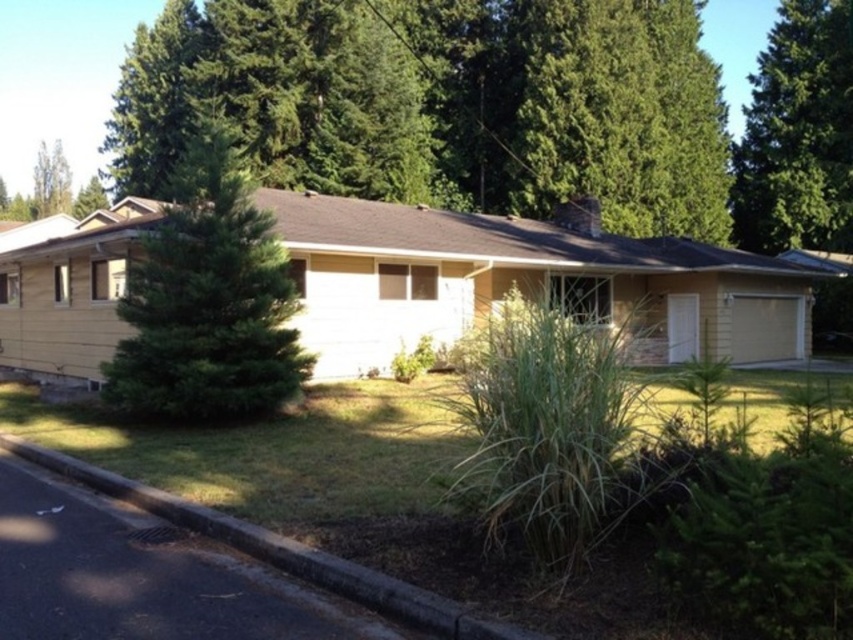
Question: Is green needle-like tree at left below green leafy tree at upper right?

Choices:
 (A) no
 (B) yes

Answer: (B)

Question: Which object is positioned closest to the green leafy tree at upper right?

Choices:
 (A) green needle-like tree at left
 (B) black asphalt curb at lower left

Answer: (A)

Question: Based on their relative distances, which object is farther from the green leafy tree at upper right?

Choices:
 (A) black asphalt curb at lower left
 (B) green needle-like tree at left

Answer: (A)

Question: Which point is closer to the camera?

Choices:
 (A) (219, 163)
 (B) (844, 116)
 (C) (329, 556)

Answer: (C)

Question: Can you confirm if green needle-like tree at left is positioned to the right of black asphalt curb at lower left?

Choices:
 (A) no
 (B) yes

Answer: (A)

Question: Is green leafy tree at upper right positioned in front of black asphalt curb at lower left?

Choices:
 (A) yes
 (B) no

Answer: (B)